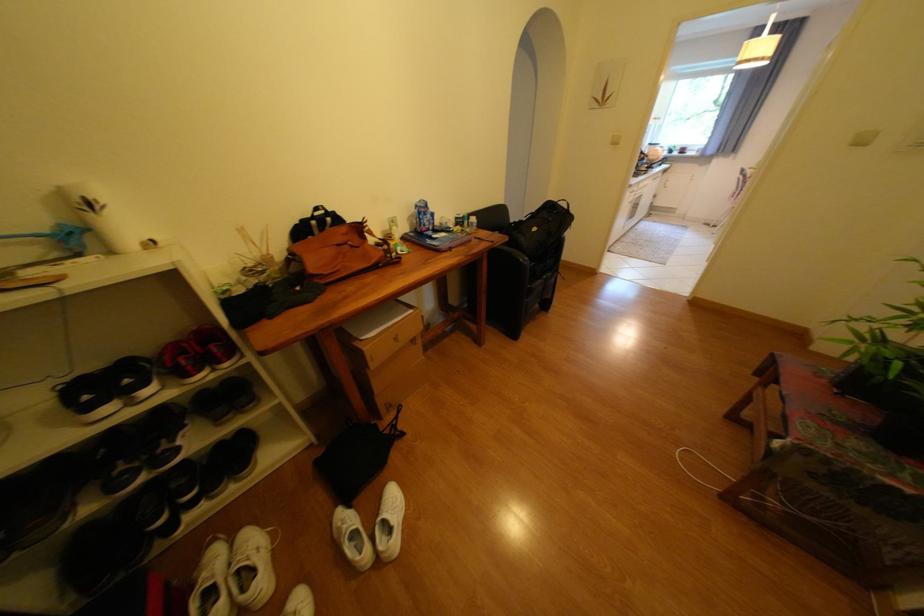
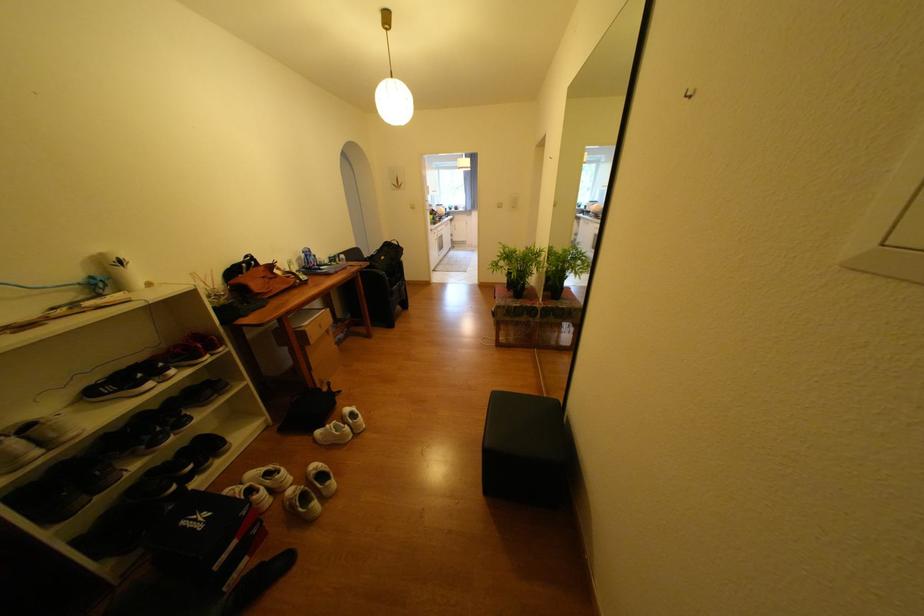
Find the pixel in the second image that matches [543,230] in the first image.

(392, 257)